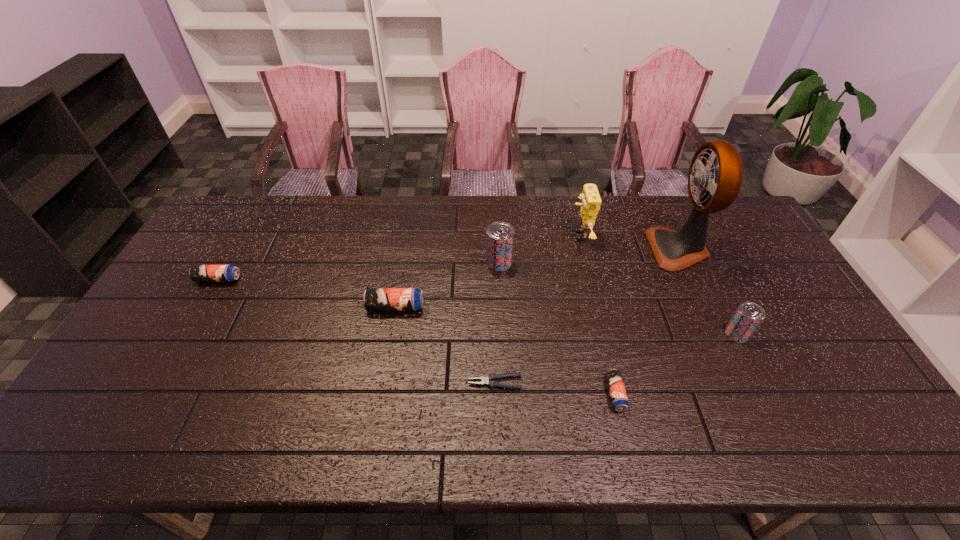
Locate an element on the screen. beer can that can be found as the third closest to the second farthest blue beer can is located at coordinates (618, 395).

Locate an element on the screen. blue beer can that stands as the closest to the third shortest object is located at coordinates (374, 299).

Locate which blue beer can is the closest to the pliers. Please provide its 2D coordinates. Your answer should be formatted as a tuple, i.e. [(x, y)], where the tuple contains the x and y coordinates of a point satisfying the conditions above.

[(618, 395)]

Find the location of a particular element. This screenshot has height=540, width=960. free space in the image that satisfies the following two spatial constraints: 1. at the gripping part of the nearest beer can; 2. on the left side of the shortest object is located at coordinates (495, 394).

Find the location of `vacant area in the image that satisfies the following two spatial constraints: 1. on the front side of the smallest blue beer can; 2. on the left side of the leftmost object`. vacant area in the image that satisfies the following two spatial constraints: 1. on the front side of the smallest blue beer can; 2. on the left side of the leftmost object is located at coordinates (x=153, y=394).

Identify the location of vacant region that satisfies the following two spatial constraints: 1. on the back side of the nearest beer can; 2. on the right side of the right red beer can. The image size is (960, 540). (601, 334).

Image resolution: width=960 pixels, height=540 pixels. Find the location of `free spot that satisfies the following two spatial constraints: 1. on the front side of the smaller red beer can; 2. on the right side of the farther red beer can`. free spot that satisfies the following two spatial constraints: 1. on the front side of the smaller red beer can; 2. on the right side of the farther red beer can is located at coordinates (502, 334).

Where is `blank space that satisfies the following two spatial constraints: 1. on the front-facing side of the fan; 2. on the front side of the sixth shortest object`? The height and width of the screenshot is (540, 960). blank space that satisfies the following two spatial constraints: 1. on the front-facing side of the fan; 2. on the front side of the sixth shortest object is located at coordinates (684, 262).

Image resolution: width=960 pixels, height=540 pixels. What are the coordinates of `free space that satisfies the following two spatial constraints: 1. on the front-facing side of the tallest object; 2. on the front side of the farthest blue beer can` in the screenshot? It's located at (692, 279).